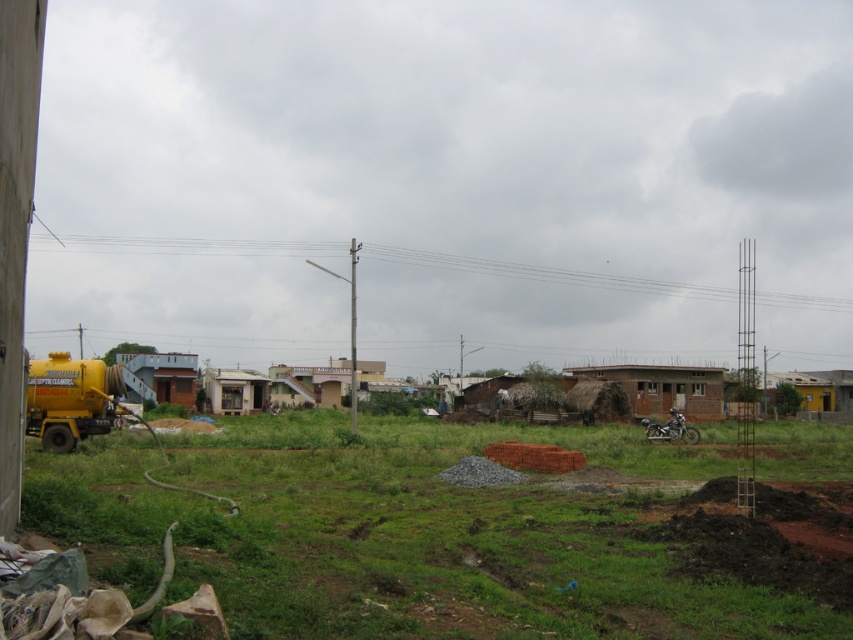
You are standing at the location of the yellow truck parked near one of the houses in the middle ground. You want to know how far you are from the point marked at coordinates point (338, 378). Can you determine the distance?

You are 95.07 meters away from point (338, 378).

You are standing at the point marked as point (405, 534) in the image. What object is located exactly at that point?

The yellow metallic truck at left is located exactly at point (405, 534).